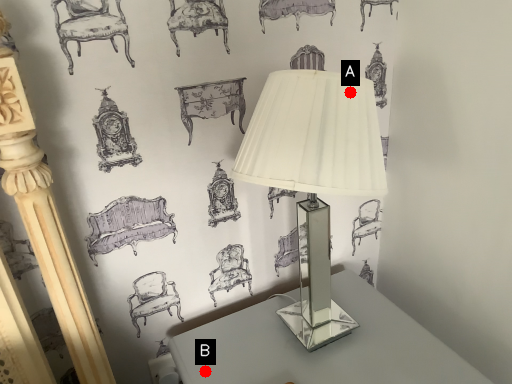
Question: Two points are circled on the image, labeled by A and B beside each circle. Which point is farther from the camera taking this photo?

Choices:
 (A) A is further
 (B) B is further

Answer: (B)